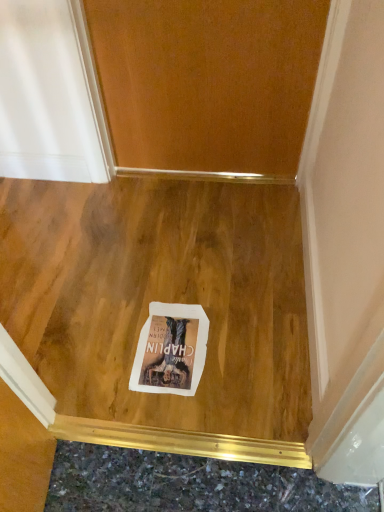
Image resolution: width=384 pixels, height=512 pixels. Find the location of `vacant area on top of wooden floor at center (from a real-world perspective)`. vacant area on top of wooden floor at center (from a real-world perspective) is located at coordinates (145, 274).